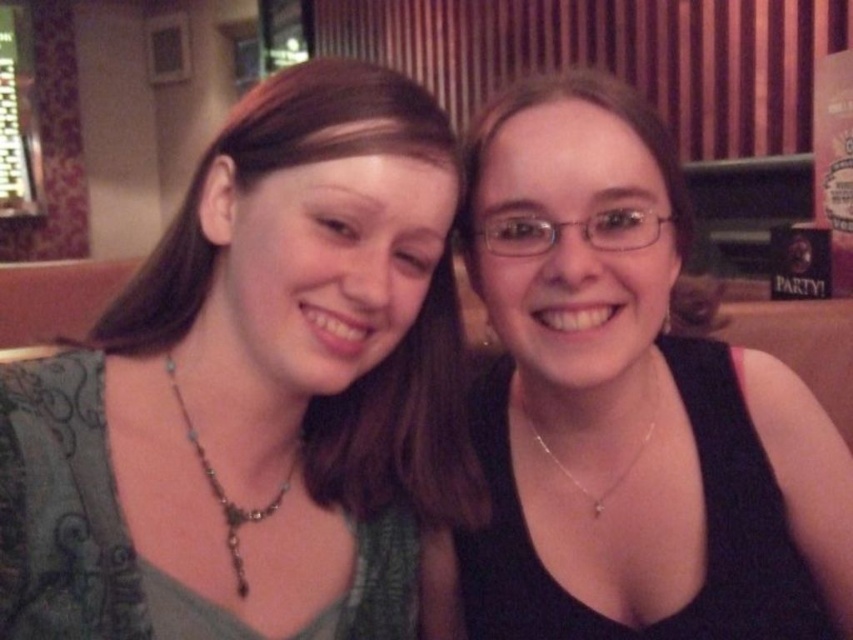
You are a photographer setting up for a group photo. You need to position the green fabric top at left and the black matte tank top at right so that both are clearly visible. Based on their current positions, which top is closer to the camera?

The green fabric top at left is in front of the black matte tank top at right, so the green fabric top at left is closer to the camera.

You are an interior designer assessing the layout of this space. The black matte tank top at right is positioned at coordinates 0.633, 0.739. If you were to place a decorative item exactly at these coordinates, where would that be relative to the individuals in the scene?

The decorative item placed at coordinates (630, 404) would be positioned where the black matte tank top at right is currently located.

You are a fashion designer observing the scene. You need to determine if the silver chain necklace at center can be worn with the black matte tank top at right without any issues. Based on their proximity in the image, can they be worn together comfortably?

The distance between the silver chain necklace at center and the black matte tank top at right is 5.10 inches, which is sufficient for the necklace to be worn comfortably with the tank top without any interference.